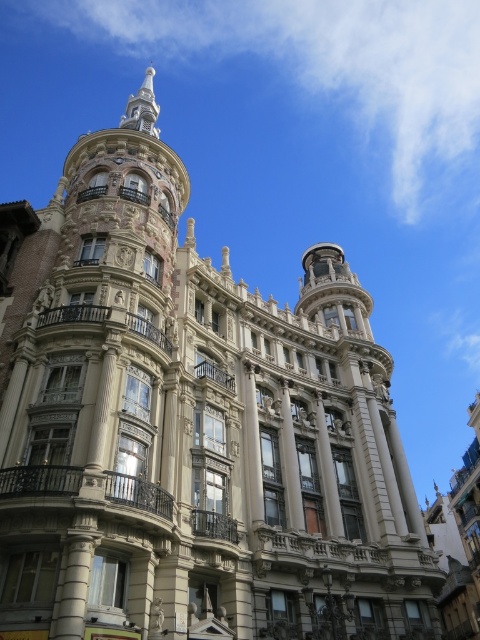
Question: Is brown polished stone pillar at center to the left of smooth stone pillar at center from the viewer's perspective?

Choices:
 (A) yes
 (B) no

Answer: (A)

Question: Which is farther from the smooth stone pillar at center?

Choices:
 (A) white marble column at center
 (B) brown polished stone pillar at center

Answer: (A)

Question: From the image, what is the correct spatial relationship of white marble column at center in relation to smooth stone pillar at center?

Choices:
 (A) right
 (B) left

Answer: (B)

Question: Which point is closer to the camera?

Choices:
 (A) brown polished stone pillar at center
 (B) smooth stone pillar at center
 (C) white marble column at center

Answer: (C)

Question: Is brown polished stone pillar at center to the left of smooth stone pillar at center from the viewer's perspective?

Choices:
 (A) yes
 (B) no

Answer: (A)

Question: Which object is positioned closest to the smooth stone pillar at center?

Choices:
 (A) brown polished stone pillar at center
 (B) white marble column at center

Answer: (A)